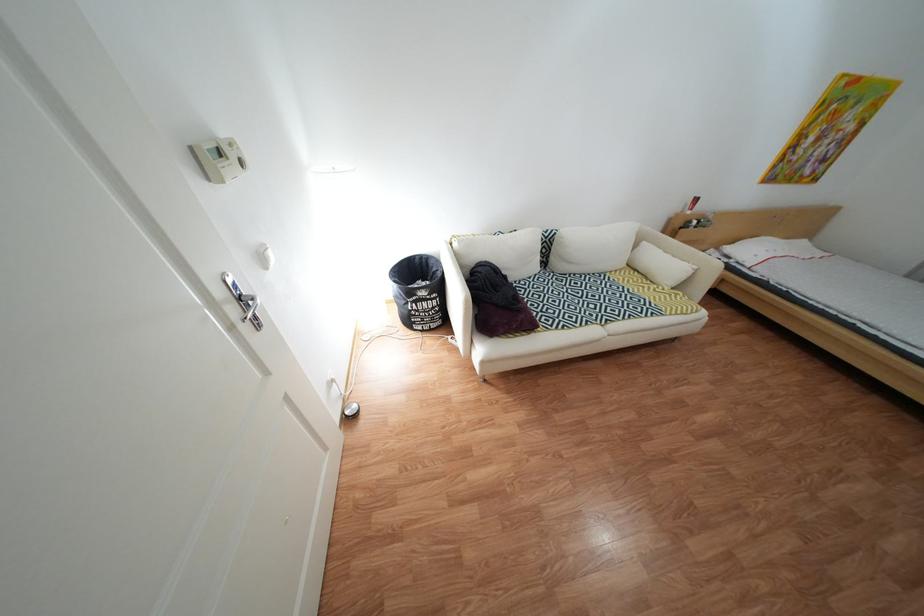
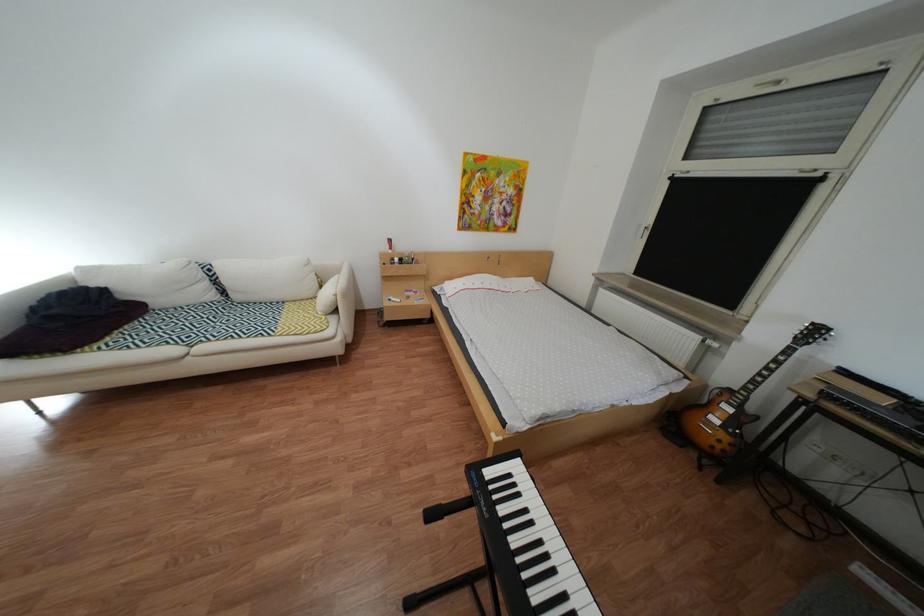
Question: The images are taken continuously from a first-person perspective. In which direction are you moving?

Choices:
 (A) Left
 (B) Right
 (C) Forward
 (D) Backward

Answer: (B)